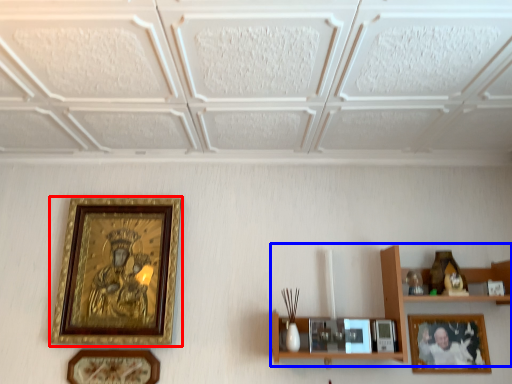
Question: Which of the following is the closest to the observer, picture frame (highlighted by a red box) or shelf (highlighted by a blue box)?

Choices:
 (A) picture frame
 (B) shelf

Answer: (B)